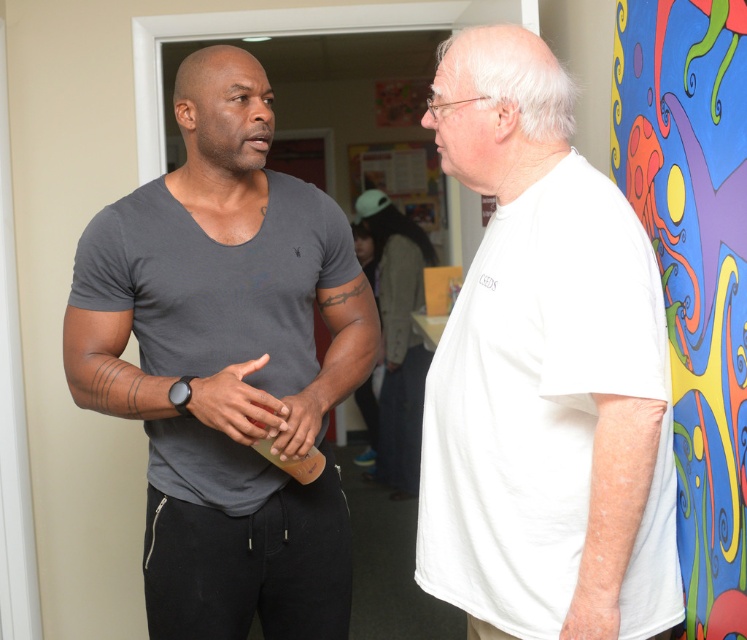
Question: Can you confirm if white matte t-shirt at right is smaller than multicolored painted octopus at right?

Choices:
 (A) no
 (B) yes

Answer: (A)

Question: Based on their relative distances, which object is farther from the white matte t-shirt at right?

Choices:
 (A) matte gray t-shirt at left
 (B) multicolored painted octopus at right

Answer: (A)

Question: Estimate the real-world distances between objects in this image. Which object is closer to the matte gray t-shirt at left?

Choices:
 (A) white matte t-shirt at right
 (B) multicolored painted octopus at right

Answer: (A)

Question: Can you confirm if white matte t-shirt at right is positioned to the right of multicolored painted octopus at right?

Choices:
 (A) yes
 (B) no

Answer: (B)

Question: Which point is farther to the camera?

Choices:
 (A) multicolored painted octopus at right
 (B) matte gray t-shirt at left

Answer: (B)

Question: Does white matte t-shirt at right have a smaller size compared to multicolored painted octopus at right?

Choices:
 (A) yes
 (B) no

Answer: (B)